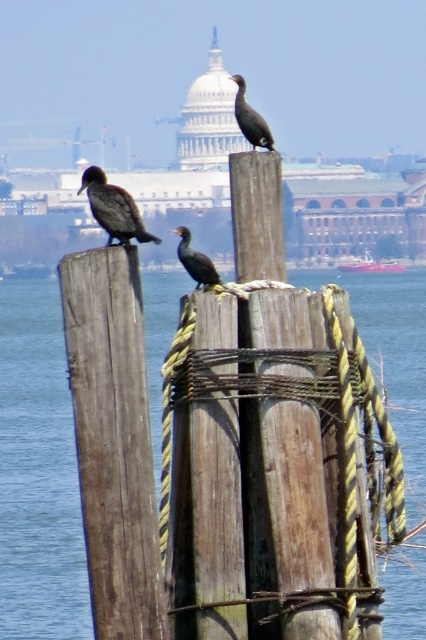
Question: Among these objects, which one is farthest from the camera?

Choices:
 (A) dark brown feathers at upper left
 (B) shiny black bird at center

Answer: (B)

Question: Which point is closer to the camera taking this photo?

Choices:
 (A) (109, 282)
 (B) (241, 129)
 (C) (40, 412)
 (D) (127, 193)

Answer: (A)

Question: Is weathered wood post at center bigger than dark brown feathers at upper center?

Choices:
 (A) yes
 (B) no

Answer: (B)

Question: Among these points, which one is farthest from the camera?

Choices:
 (A) (112, 205)
 (B) (273, 147)
 (C) (209, 262)

Answer: (B)

Question: Can you confirm if transparent water at center is bigger than dark brown feathers at upper center?

Choices:
 (A) yes
 (B) no

Answer: (A)

Question: From the image, what is the correct spatial relationship of dark brown feathers at upper left in relation to orange plastic boat at center?

Choices:
 (A) right
 (B) left

Answer: (B)